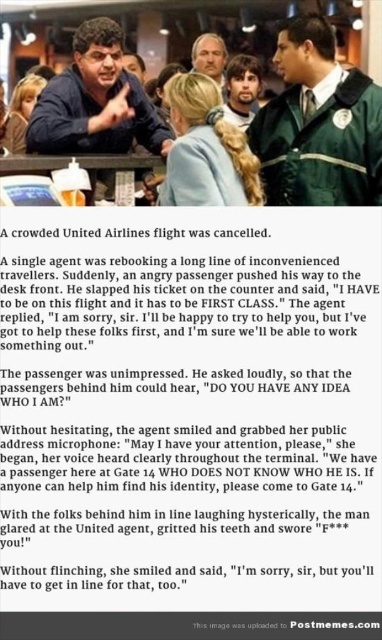
Can you confirm if dark brown hair at center is positioned to the right of smooth brown hair at center?

Indeed, dark brown hair at center is positioned on the right side of smooth brown hair at center.

Who is taller, dark brown hair at center or smooth brown hair at center?

Standing taller between the two is dark brown hair at center.

Identify the location of dark brown hair at center. This screenshot has width=382, height=640. (242, 90).

The image size is (382, 640). What do you see at coordinates (318, 124) in the screenshot?
I see `green uniform at center` at bounding box center [318, 124].

Does green uniform at center have a smaller size compared to dark brown hair at center?

Yes, green uniform at center is smaller than dark brown hair at center.

Who is more forward, (x=302, y=132) or (x=255, y=97)?

Positioned in front is point (x=302, y=132).

Find the location of `green uniform at center`. green uniform at center is located at coordinates (318, 124).

Does point (176, 557) come farther from viewer compared to point (333, 108)?

No, (176, 557) is in front of (333, 108).

Locate an element on the screen. This screenshot has height=640, width=382. black paper at center is located at coordinates (189, 410).

Identify the location of black paper at center. (189, 410).